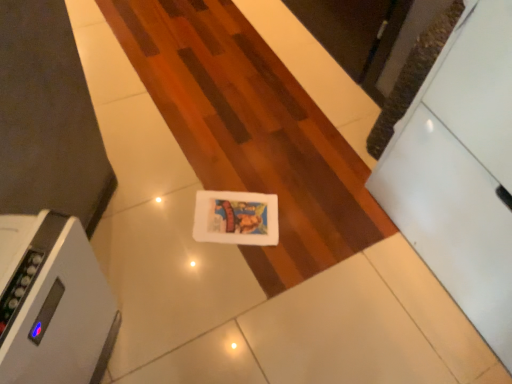
Question: Can you confirm if white glossy drawer at right is taller than gray plastic air purifier at lower left?

Choices:
 (A) yes
 (B) no

Answer: (A)

Question: Would you say white glossy drawer at right is outside gray plastic air purifier at lower left?

Choices:
 (A) no
 (B) yes

Answer: (B)

Question: Can you confirm if white glossy drawer at right is bigger than gray plastic air purifier at lower left?

Choices:
 (A) yes
 (B) no

Answer: (A)

Question: Would you say gray plastic air purifier at lower left is part of white glossy drawer at right's contents?

Choices:
 (A) no
 (B) yes

Answer: (A)

Question: Is white glossy drawer at right oriented towards gray plastic air purifier at lower left?

Choices:
 (A) no
 (B) yes

Answer: (B)

Question: Does white glossy drawer at right touch gray plastic air purifier at lower left?

Choices:
 (A) yes
 (B) no

Answer: (B)

Question: Considering the relative sizes of gray plastic air purifier at lower left and white glossy drawer at right in the image provided, is gray plastic air purifier at lower left smaller than white glossy drawer at right?

Choices:
 (A) yes
 (B) no

Answer: (A)

Question: Is gray plastic air purifier at lower left bigger than white glossy drawer at right?

Choices:
 (A) no
 (B) yes

Answer: (A)

Question: Does gray plastic air purifier at lower left come in front of white glossy drawer at right?

Choices:
 (A) yes
 (B) no

Answer: (B)

Question: From a real-world perspective, is gray plastic air purifier at lower left physically above white glossy drawer at right?

Choices:
 (A) no
 (B) yes

Answer: (A)

Question: Is gray plastic air purifier at lower left outside white glossy drawer at right?

Choices:
 (A) no
 (B) yes

Answer: (B)

Question: Considering the relative positions of gray plastic air purifier at lower left and white glossy drawer at right in the image provided, is gray plastic air purifier at lower left to the right of white glossy drawer at right from the viewer's perspective?

Choices:
 (A) no
 (B) yes

Answer: (A)

Question: Considering the positions of white glossy drawer at right and gray plastic air purifier at lower left in the image, is white glossy drawer at right taller or shorter than gray plastic air purifier at lower left?

Choices:
 (A) short
 (B) tall

Answer: (B)